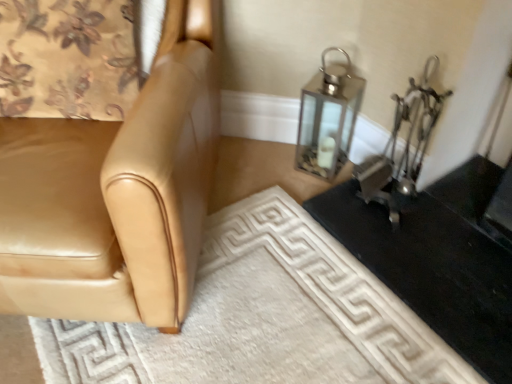
Measure the distance between point (41, 344) and camera.

They are 1.11 meters apart.

Identify the location of metallic lantern at upper right. (328, 118).

What is the approximate width of metallic lantern at upper right?

metallic lantern at upper right is 10.87 inches in width.

Locate an element on the screen. This screenshot has width=512, height=384. tan leather chair at left is located at coordinates (116, 193).

Image resolution: width=512 pixels, height=384 pixels. What do you see at coordinates (67, 59) in the screenshot?
I see `floral fabric curtain at upper left` at bounding box center [67, 59].

This screenshot has height=384, width=512. I want to click on white textured doormat at lower center, so click(263, 317).

How many degrees apart are the facing directions of metallic lantern at upper right and white textured doormat at lower center?

The angle between the facing direction of metallic lantern at upper right and the facing direction of white textured doormat at lower center is 47.1 degrees.

From the image's perspective, relative to white textured doormat at lower center, is metallic lantern at upper right above or below?

metallic lantern at upper right is above white textured doormat at lower center.

Which point is more distant from viewer, (x=340, y=65) or (x=216, y=239)?

The point (x=340, y=65) is farther from the camera.

Between metallic lantern at upper right and white textured doormat at lower center, which one has more height?

metallic lantern at upper right.

Based on the photo, does floral fabric curtain at upper left appear on the right side of black glossy table at lower right?

No, floral fabric curtain at upper left is not to the right of black glossy table at lower right.

Would you say floral fabric curtain at upper left is a long distance from black glossy table at lower right?

No.

Is floral fabric curtain at upper left facing towards black glossy table at lower right?

No, floral fabric curtain at upper left is not oriented towards black glossy table at lower right.

The width and height of the screenshot is (512, 384). Find the location of `table located underneath the floral fabric curtain at upper left (from a real-world perspective)`. table located underneath the floral fabric curtain at upper left (from a real-world perspective) is located at coordinates (437, 259).

From the image's perspective, which one is positioned lower, tan leather chair at left or white textured doormat at lower center?

white textured doormat at lower center, from the image's perspective.

Based on the photo, could you tell me if tan leather chair at left is facing white textured doormat at lower center?

No, tan leather chair at left is not turned towards white textured doormat at lower center.

Does tan leather chair at left have a greater width compared to white textured doormat at lower center?

Yes.

Is point (81, 233) more distant than point (367, 351)?

That is False.

Considering the relative sizes of black glossy table at lower right and white textured doormat at lower center in the image provided, is black glossy table at lower right smaller than white textured doormat at lower center?

Yes, black glossy table at lower right is smaller than white textured doormat at lower center.

Find the location of a particular element. table that is on the right side of white textured doormat at lower center is located at coordinates (437, 259).

Which is more to the left, black glossy table at lower right or white textured doormat at lower center?

Positioned to the left is white textured doormat at lower center.

From the picture: Considering the relative sizes of black glossy table at lower right and white textured doormat at lower center in the image provided, is black glossy table at lower right shorter than white textured doormat at lower center?

Yes.

Considering the positions of points (494, 368) and (331, 66), is point (494, 368) farther from camera compared to point (331, 66)?

No.

Identify the location of table on the right of metallic lantern at upper right. (437, 259).

Is black glossy table at lower right oriented towards metallic lantern at upper right?

No, black glossy table at lower right does not turn towards metallic lantern at upper right.

Is black glossy table at lower right inside or outside of metallic lantern at upper right?

black glossy table at lower right is not enclosed by metallic lantern at upper right.

What's the angular difference between metallic lantern at upper right and black glossy table at lower right's facing directions?

The angle between the facing direction of metallic lantern at upper right and the facing direction of black glossy table at lower right is 44.9 degrees.

Looking at this image, from a real-world perspective, is metallic lantern at upper right positioned over black glossy table at lower right based on gravity?

Indeed, from a real-world perspective, metallic lantern at upper right stands above black glossy table at lower right.

Is metallic lantern at upper right taller or shorter than black glossy table at lower right?

metallic lantern at upper right is taller than black glossy table at lower right.

Is the position of white textured doormat at lower center more distant than that of black glossy table at lower right?

That is False.

This screenshot has width=512, height=384. In order to click on doormat located underneath the black glossy table at lower right (from a real-world perspective) in this screenshot , I will do `click(263, 317)`.

Is white textured doormat at lower center positioned far away from black glossy table at lower right?

Actually, white textured doormat at lower center and black glossy table at lower right are a little close together.

In terms of width, does white textured doormat at lower center look wider or thinner when compared to black glossy table at lower right?

In the image, white textured doormat at lower center appears to be wider than black glossy table at lower right.

I want to click on doormat on the left side of metallic lantern at upper right, so click(x=263, y=317).

Identify the location of table in front of the floral fabric curtain at upper left. (437, 259).

Which object lies further to the anchor point white textured doormat at lower center, black glossy table at lower right or metallic lantern at upper right?

metallic lantern at upper right lies further to white textured doormat at lower center than the other object.

When comparing their distances from white textured doormat at lower center, does black glossy table at lower right or tan leather chair at left seem closer?

Among the two, black glossy table at lower right is located nearer to white textured doormat at lower center.

Estimate the real-world distances between objects in this image. Which object is closer to black glossy table at lower right, white textured doormat at lower center or floral fabric curtain at upper left?

white textured doormat at lower center is positioned closer to the anchor black glossy table at lower right.

Estimate the real-world distances between objects in this image. Which object is further from tan leather chair at left, black glossy table at lower right or floral fabric curtain at upper left?

black glossy table at lower right is positioned further to the anchor tan leather chair at left.

When comparing their distances from black glossy table at lower right, does metallic lantern at upper right or tan leather chair at left seem further?

tan leather chair at left lies further to black glossy table at lower right than the other object.

Based on the photo, when comparing their distances from tan leather chair at left, does floral fabric curtain at upper left or black glossy table at lower right seem further?

Based on the image, black glossy table at lower right appears to be further to tan leather chair at left.

Based on their spatial positions, is white textured doormat at lower center or black glossy table at lower right closer to floral fabric curtain at upper left?

white textured doormat at lower center.

Based on their spatial positions, is floral fabric curtain at upper left or tan leather chair at left further from black glossy table at lower right?

floral fabric curtain at upper left lies further to black glossy table at lower right than the other object.

Locate an element on the screen. doormat between floral fabric curtain at upper left and black glossy table at lower right from left to right is located at coordinates (263, 317).

Where is `oil lamp between tan leather chair at left and black glossy table at lower right`? oil lamp between tan leather chair at left and black glossy table at lower right is located at coordinates (328, 118).

Where is `doormat between tan leather chair at left and metallic lantern at upper right in the horizontal direction`? The height and width of the screenshot is (384, 512). doormat between tan leather chair at left and metallic lantern at upper right in the horizontal direction is located at coordinates (263, 317).

Find the location of a particular element. Image resolution: width=512 pixels, height=384 pixels. oil lamp that lies between floral fabric curtain at upper left and white textured doormat at lower center from top to bottom is located at coordinates (328, 118).